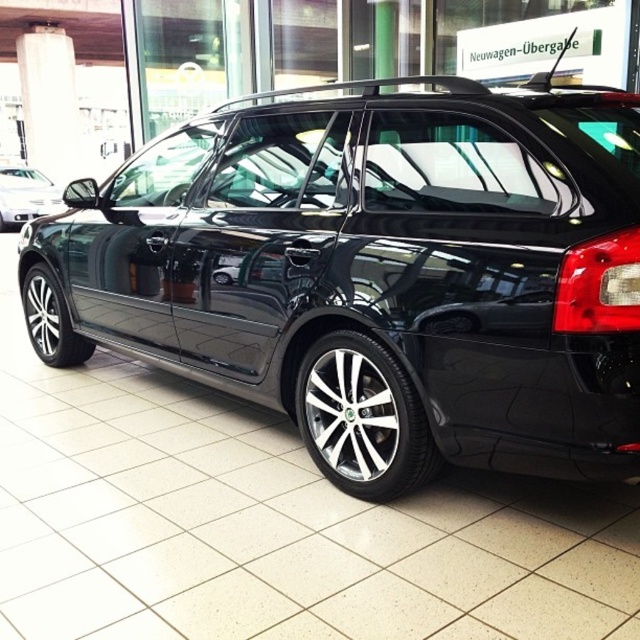
Question: Is glossy black car at center below matte black car at left?

Choices:
 (A) no
 (B) yes

Answer: (B)

Question: From the image, what is the correct spatial relationship of glossy black car at center in relation to matte black car at left?

Choices:
 (A) right
 (B) left

Answer: (A)

Question: Which point is closer to the camera?

Choices:
 (A) (29, 198)
 (B) (163, 163)

Answer: (B)

Question: Which point is closer to the camera?

Choices:
 (A) (56, 198)
 (B) (193, 173)

Answer: (B)

Question: Is the position of glossy black car at center more distant than that of matte black car at left?

Choices:
 (A) no
 (B) yes

Answer: (A)